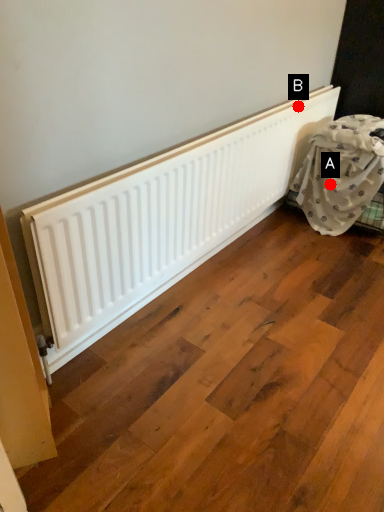
Question: Two points are circled on the image, labeled by A and B beside each circle. Which point is farther to the camera?

Choices:
 (A) A is further
 (B) B is further

Answer: (A)